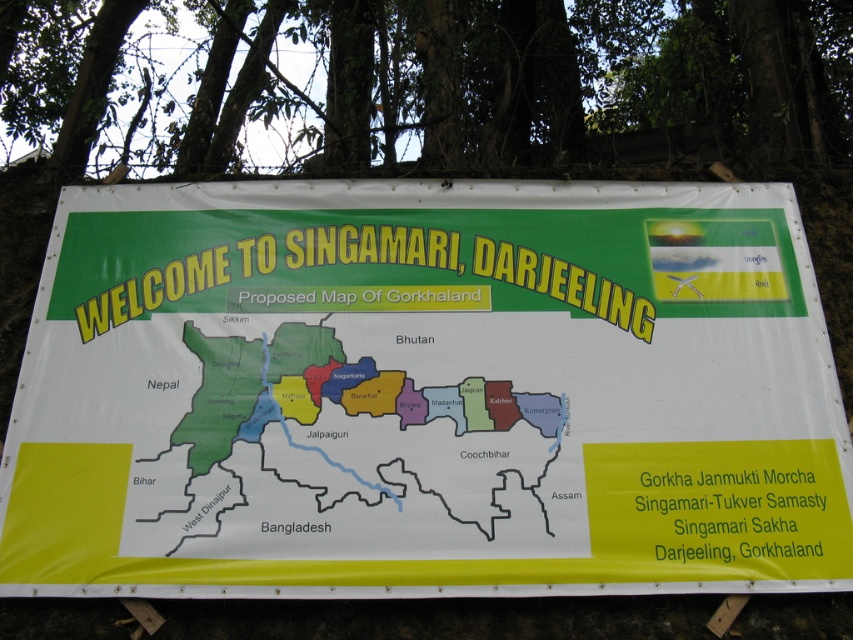
Question: Which point is closer to the camera taking this photo?

Choices:
 (A) (350, 52)
 (B) (218, 384)

Answer: (B)

Question: Is white paper poster at center further to camera compared to green leafy tree at upper center?

Choices:
 (A) no
 (B) yes

Answer: (A)

Question: Among these objects, which one is farthest from the camera?

Choices:
 (A) green leafy tree at upper center
 (B) yellow paper map at center
 (C) white paper poster at center

Answer: (A)

Question: Does white paper poster at center lie in front of green leafy tree at upper center?

Choices:
 (A) yes
 (B) no

Answer: (A)

Question: Does white paper poster at center lie behind yellow paper map at center?

Choices:
 (A) yes
 (B) no

Answer: (B)

Question: Based on their relative distances, which object is farther from the white paper poster at center?

Choices:
 (A) green leafy tree at upper center
 (B) yellow paper map at center

Answer: (A)